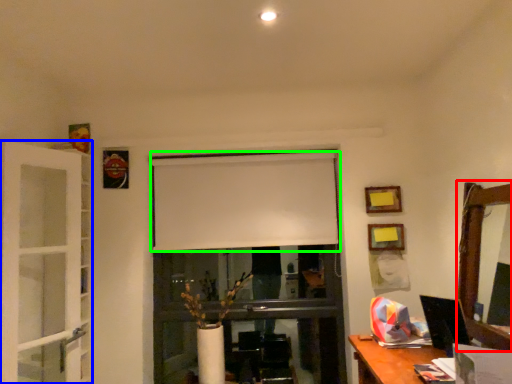
Question: Which is farther away from mirror (highlighted by a red box)? screen door (highlighted by a blue box) or curtain (highlighted by a green box)?

Choices:
 (A) screen door
 (B) curtain

Answer: (A)